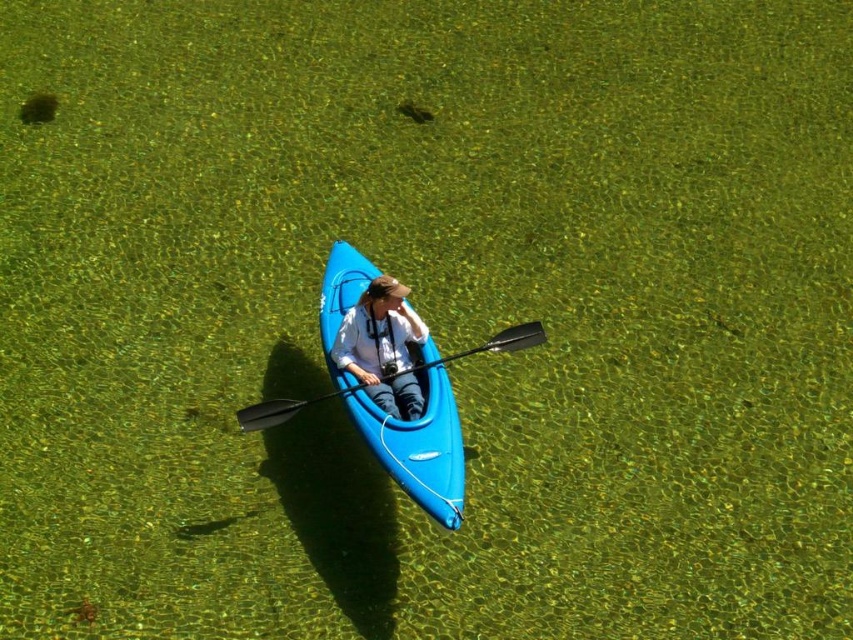
You are a photographer trying to capture a closeup of the white fabric person at center and the black plastic paddle at center in the kayak. What is the minimum distance you need to maintain between the camera and the subjects to ensure both are in focus?

The white fabric person at center and black plastic paddle at center are 10.48 inches apart from each other. To ensure both are in focus, the camera should be positioned at a distance where the depth of field can cover this separation. A general rule of thumb is to be at least twice the distance of the farthest subject from the camera, so maintaining around 20.96 inches or more would work.

You are a photographer trying to capture the blue plastic canoe at center and the black plastic paddle at center in the same frame. Based on their positions, which object should you focus on first to ensure both are in the shot?

The blue plastic canoe at center is to the right of the black plastic paddle at center, so you should focus on the black plastic paddle at center first to ensure both are in the shot.

Based on the photo, you are a photographer trying to capture the reflection of the blue plastic canoe at center in the water. Since the white fabric person at center is blocking your view, can you move the person to the side to get a clear shot?

The blue plastic canoe at center is below the white fabric person at center, so moving the person to the side would allow you to see the reflection of the blue plastic canoe at center in the water.